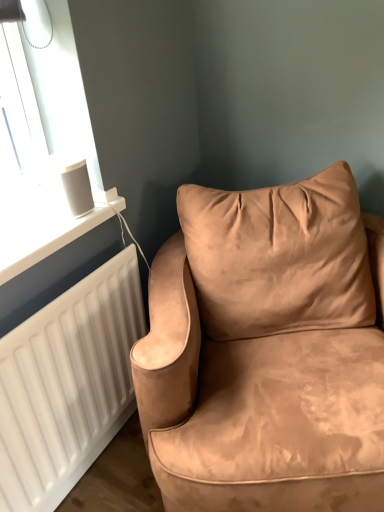
I want to click on suede-like beige armchair at center-right, so click(266, 351).

This screenshot has width=384, height=512. Describe the element at coordinates (266, 351) in the screenshot. I see `suede-like beige armchair at center-right` at that location.

Locate an element on the screen. This screenshot has height=512, width=384. suede-like beige armchair at center-right is located at coordinates (266, 351).